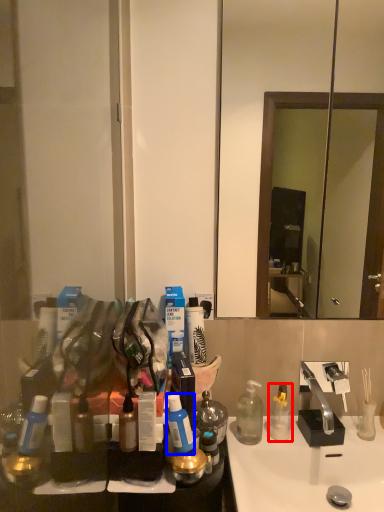
Question: Which object appears farthest to the camera in this image, bottle (highlighted by a red box) or bottle (highlighted by a blue box)?

Choices:
 (A) bottle
 (B) bottle

Answer: (A)